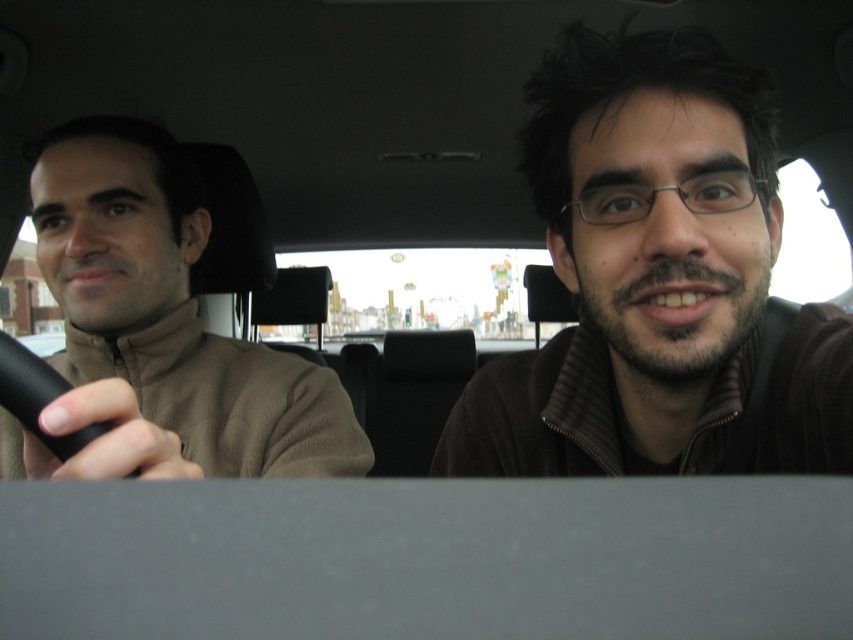
Who is taller, brown fuzzy sweater at upper right or brown fleece at left?

brown fuzzy sweater at upper right is taller.

What do you see at coordinates (635, 262) in the screenshot? I see `brown fuzzy sweater at upper right` at bounding box center [635, 262].

Where is `brown fuzzy sweater at upper right`? brown fuzzy sweater at upper right is located at coordinates (635, 262).

In order to click on brown fuzzy sweater at upper right in this screenshot , I will do `click(635, 262)`.